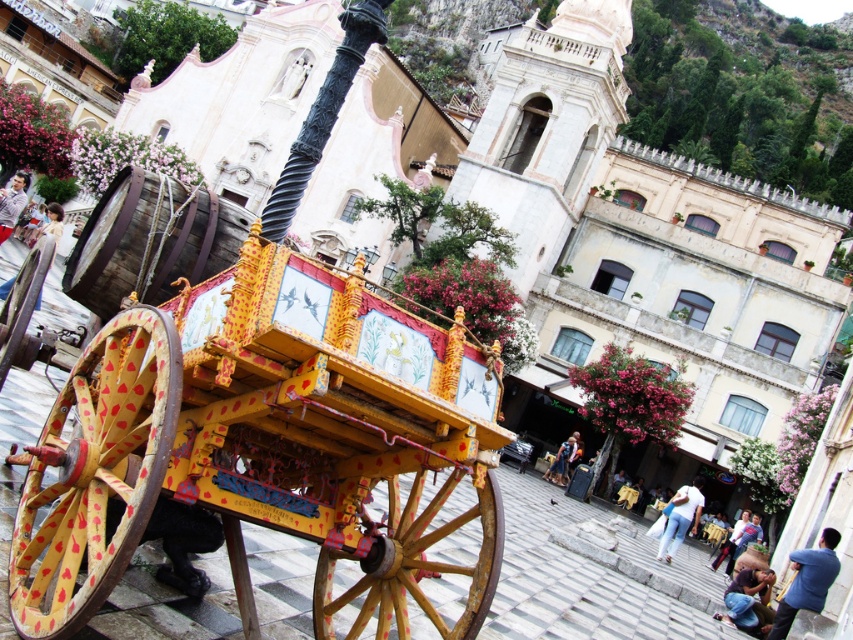
Between point (689, 520) and point (570, 445), which one is positioned behind?

The point (570, 445) is behind.

Is light blue jeans at lower right taller than denim jacket at lower right?

Yes.

Who is more forward, (666, 563) or (570, 461)?

Point (666, 563)

In order to click on light blue jeans at lower right in this screenshot , I will do `click(682, 516)`.

Does yellow painted wood wheel at lower left lie in front of light blue jeans at lower right?

Yes, it is.

Is the position of yellow painted wood wheel at lower left more distant than that of light blue jeans at lower right?

That is False.

The width and height of the screenshot is (853, 640). Describe the element at coordinates (94, 474) in the screenshot. I see `yellow painted wood wheel at lower left` at that location.

Identify the location of yellow painted wood wheel at lower left. This screenshot has height=640, width=853. (94, 474).

Is yellow painted wood wheel at lower left smaller than wooden cartwheel at center?

Indeed, yellow painted wood wheel at lower left has a smaller size compared to wooden cartwheel at center.

Can you confirm if yellow painted wood wheel at lower left is wider than wooden cartwheel at center?

Yes, yellow painted wood wheel at lower left is wider than wooden cartwheel at center.

Locate an element on the screen. yellow painted wood wheel at lower left is located at coordinates (94, 474).